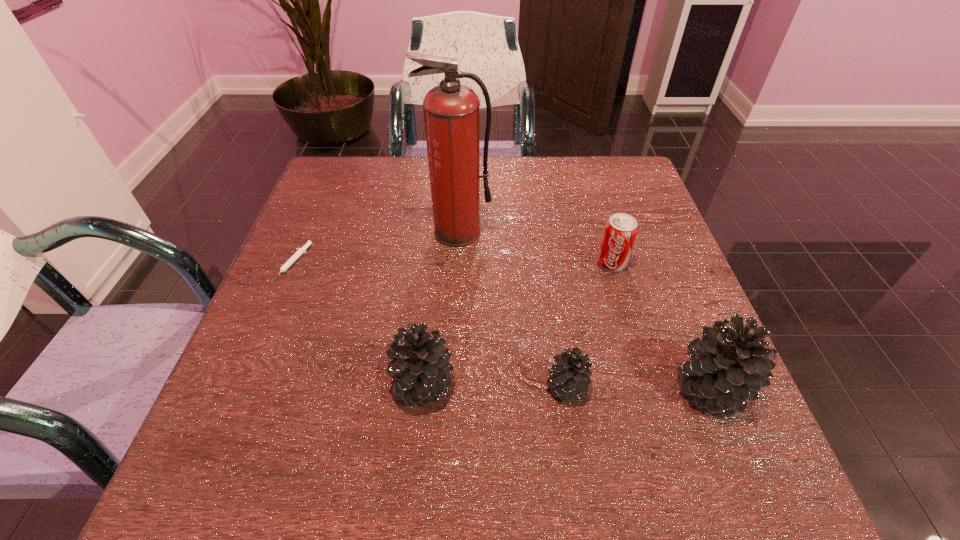
Find the location of a particular element. unoccupied position between the soda can and the rightmost pinecone is located at coordinates (661, 326).

Locate an element on the screen. Image resolution: width=960 pixels, height=540 pixels. free point between the leftmost pinecone and the third object from right to left is located at coordinates (494, 385).

Select which object is the fifth closest to the leftmost pinecone. Please provide its 2D coordinates. Your answer should be formatted as a tuple, i.e. [(x, y)], where the tuple contains the x and y coordinates of a point satisfying the conditions above.

[(729, 365)]

This screenshot has height=540, width=960. Find the location of `the fifth closest object relative to the tallest object`. the fifth closest object relative to the tallest object is located at coordinates (729, 365).

The image size is (960, 540). I want to click on pinecone that is the closest to the rightmost object, so click(571, 375).

This screenshot has height=540, width=960. What are the coordinates of `pinecone that is the second closest one to the fire extinguisher` in the screenshot? It's located at (571, 375).

In order to click on vacant point that satisfies the following two spatial constraints: 1. on the front side of the rightmost pinecone; 2. on the left side of the second pinecone from left to right in this screenshot , I will do `click(566, 388)`.

The width and height of the screenshot is (960, 540). Identify the location of vacant region that satisfies the following two spatial constraints: 1. at the nozzle of the rightmost object; 2. on the left side of the fire extinguisher. click(x=450, y=388).